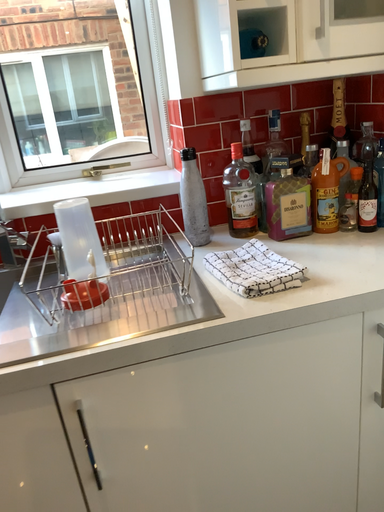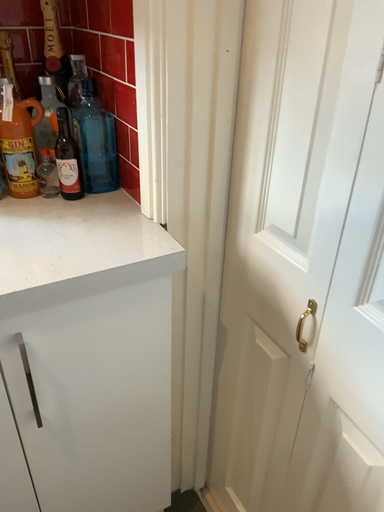
Question: Which way did the camera rotate in the video?

Choices:
 (A) rotated left
 (B) rotated right

Answer: (B)